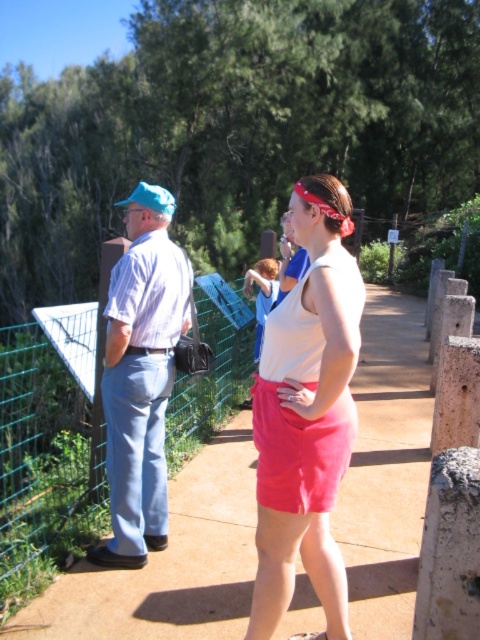
Question: Is sandy concrete sidewalk at center bigger than white cotton tank top at center?

Choices:
 (A) no
 (B) yes

Answer: (B)

Question: Considering the relative positions of white cotton tank top at center and green wire mesh fence at left in the image provided, where is white cotton tank top at center located with respect to green wire mesh fence at left?

Choices:
 (A) below
 (B) above

Answer: (A)

Question: Which of the following is the closest to the observer?

Choices:
 (A) (126, 273)
 (B) (376, 563)

Answer: (A)

Question: Considering the relative positions of sandy concrete sidewalk at center and white cotton tank top at center in the image provided, where is sandy concrete sidewalk at center located with respect to white cotton tank top at center?

Choices:
 (A) right
 (B) left

Answer: (A)

Question: Which of the following is the closest to the observer?

Choices:
 (A) sandy concrete sidewalk at center
 (B) light blue denim pants at left

Answer: (A)

Question: Which point is closer to the camera?

Choices:
 (A) (151, 499)
 (B) (27, 424)
 (C) (333, 625)

Answer: (C)